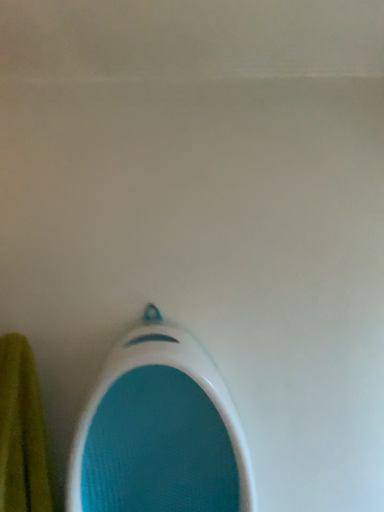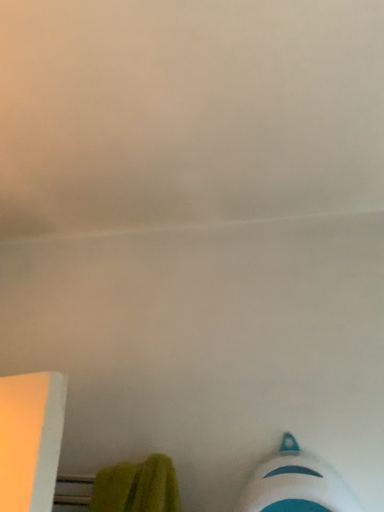
Question: How did the camera likely rotate when shooting the video?

Choices:
 (A) rotated left
 (B) rotated right

Answer: (A)